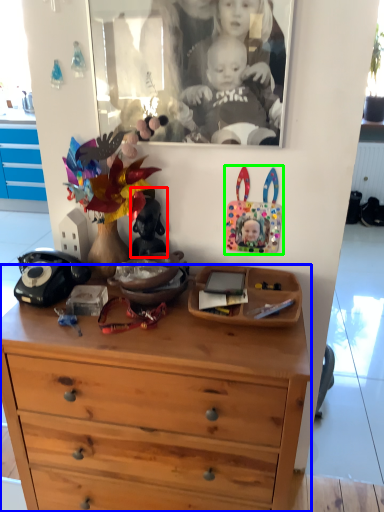
Question: Considering the real-world distances, which object is farthest from toy (highlighted by a red box)? chest of drawers (highlighted by a blue box) or toy (highlighted by a green box)?

Choices:
 (A) chest of drawers
 (B) toy

Answer: (A)